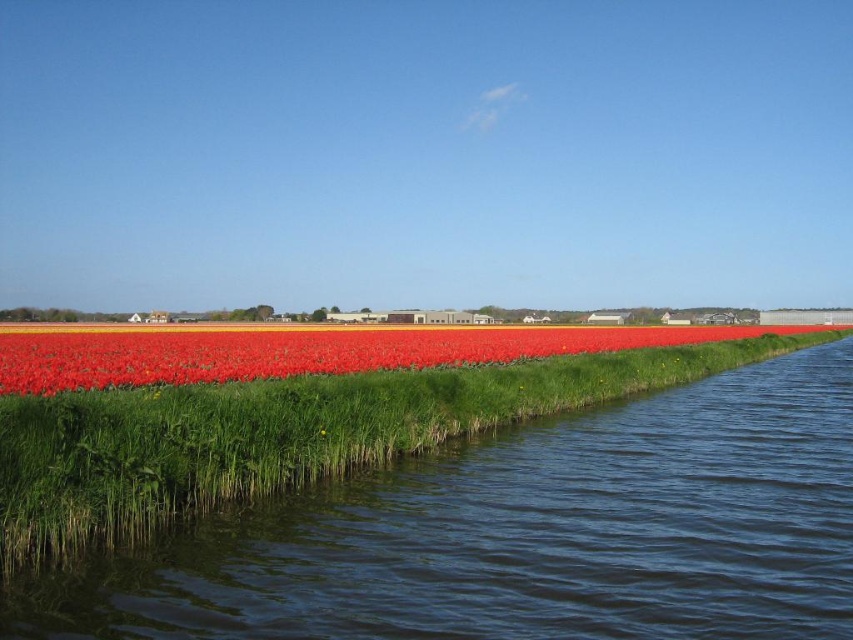
Question: Among these objects, which one is nearest to the camera?

Choices:
 (A) bright red petals at center
 (B) dark blue water at lower center

Answer: (B)

Question: Is dark blue water at lower center bigger than bright red petals at center?

Choices:
 (A) yes
 (B) no

Answer: (B)

Question: Which point appears farthest from the camera in this image?

Choices:
 (A) (77, 349)
 (B) (349, 557)

Answer: (A)

Question: Is dark blue water at lower center wider than bright red petals at center?

Choices:
 (A) yes
 (B) no

Answer: (B)

Question: Which point is closer to the camera taking this photo?

Choices:
 (A) (698, 332)
 (B) (358, 556)

Answer: (B)

Question: Is dark blue water at lower center further to the viewer compared to bright red petals at center?

Choices:
 (A) no
 (B) yes

Answer: (A)